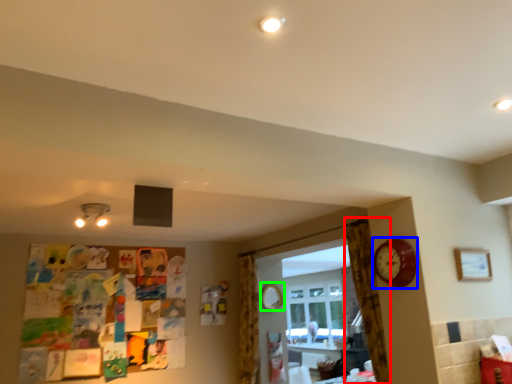
Question: Based on their relative distances, which object is farther from curtain (highlighted by a red box)? Choose from clock (highlighted by a blue box) and mirror (highlighted by a green box).

Choices:
 (A) clock
 (B) mirror

Answer: (B)